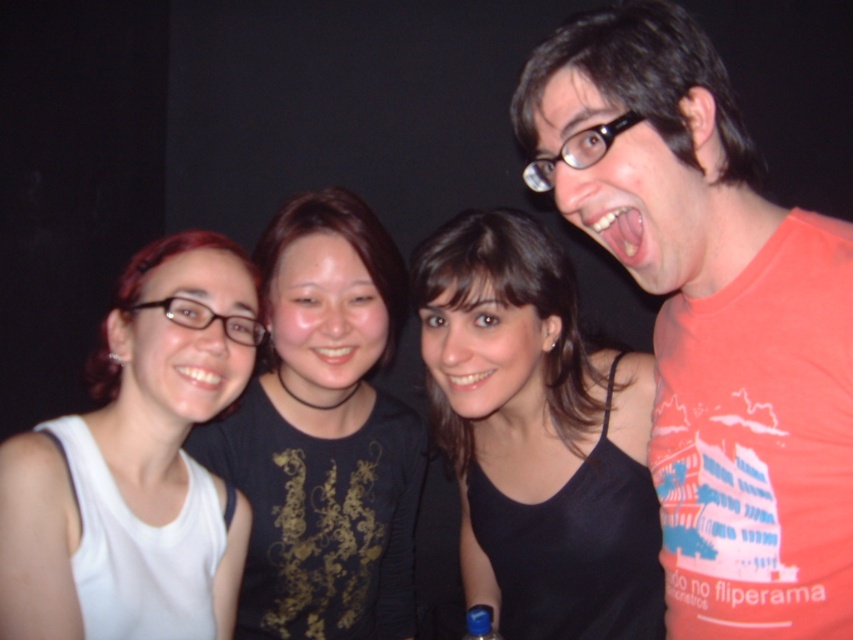
Question: Does black matte shirt at center come behind white matte tank top at left?

Choices:
 (A) no
 (B) yes

Answer: (B)

Question: Is black fabric at center below black matte shirt at center?

Choices:
 (A) yes
 (B) no

Answer: (B)

Question: In this image, where is orange cotton t-shirt at right located relative to black matte shirt at center?

Choices:
 (A) left
 (B) right

Answer: (B)

Question: Estimate the real-world distances between objects in this image. Which object is farther from the black fabric at center?

Choices:
 (A) orange cotton t-shirt at right
 (B) white matte tank top at left
 (C) black matte shirt at center

Answer: (B)

Question: Which is nearer to the orange cotton t-shirt at right?

Choices:
 (A) black matte shirt at center
 (B) black fabric at center
 (C) white matte tank top at left

Answer: (B)

Question: Which object is positioned farthest from the black fabric at center?

Choices:
 (A) orange cotton t-shirt at right
 (B) black matte shirt at center
 (C) white matte tank top at left

Answer: (C)